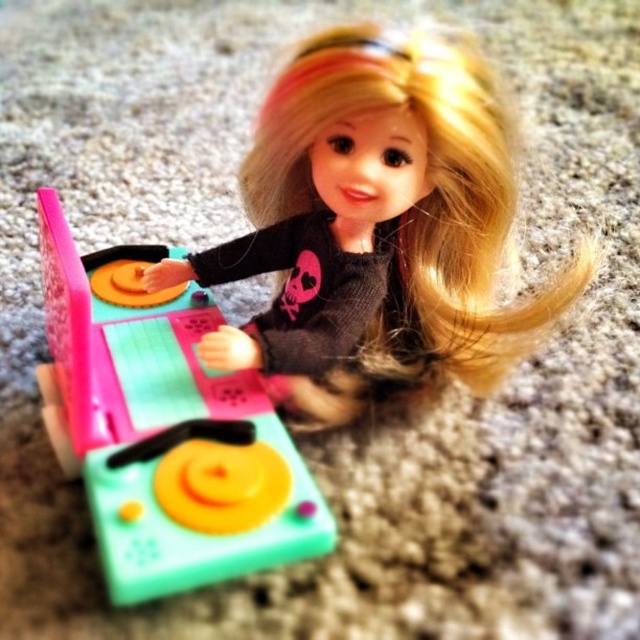
You are setting up a display for a toy store and need to ensure that the black matte doll at center and the matte plastic turntable at center can fit side by side on a shelf that is 1 meter wide. Based on the information provided, can they both fit without overlapping?

The black matte doll at center might be wider than the matte plastic turntable at center, so there is uncertainty about their combined width. If the doll is indeed wider, the total width could exceed 1 meter, making it uncertain if they can fit without overlapping. Further measurements are needed to confirm.

You are a photographer trying to capture the perfect shot of the doll and the toy DJ turntable. You notice two specific points in the image labeled as point 1 at coordinates point (x=394, y=220) and point 2 at coordinates point (x=224, y=472). Which point is closer to the camera?

Point (x=224, y=472) is closer to the camera because point (x=394, y=220) is behind it according to the description.

You are holding a 12 inch ruler. If you want to measure the distance between you and the black matte doll at center, can you reach it without moving your hand?

The distance between the black matte doll at center and the viewer is 35.46 inches. Since the ruler is only 12 inches long, you cannot reach the doll without moving your hand.